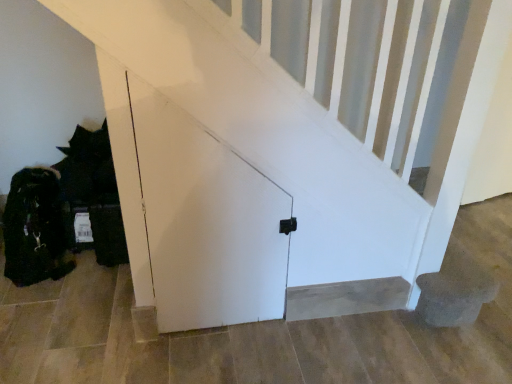
Question: Does smooth beige carpet at lower center appear on the left side of white matte door at center?

Choices:
 (A) no
 (B) yes

Answer: (A)

Question: Can you confirm if smooth beige carpet at lower center is shorter than white matte door at center?

Choices:
 (A) no
 (B) yes

Answer: (B)

Question: Does smooth beige carpet at lower center have a lesser width compared to white matte door at center?

Choices:
 (A) yes
 (B) no

Answer: (A)

Question: Can you confirm if smooth beige carpet at lower center is taller than white matte door at center?

Choices:
 (A) yes
 (B) no

Answer: (B)

Question: Considering the relative sizes of smooth beige carpet at lower center and white matte door at center in the image provided, is smooth beige carpet at lower center bigger than white matte door at center?

Choices:
 (A) no
 (B) yes

Answer: (A)

Question: Is smooth beige carpet at lower center not near white matte door at center?

Choices:
 (A) yes
 (B) no

Answer: (B)

Question: Can smooth beige carpet at lower center be found inside white matte door at center?

Choices:
 (A) no
 (B) yes

Answer: (A)

Question: Is white matte door at center at the right side of smooth beige carpet at lower center?

Choices:
 (A) yes
 (B) no

Answer: (B)

Question: Can you confirm if white matte door at center is wider than smooth beige carpet at lower center?

Choices:
 (A) no
 (B) yes

Answer: (B)

Question: Is white matte door at center positioned far away from smooth beige carpet at lower center?

Choices:
 (A) no
 (B) yes

Answer: (A)

Question: Is white matte door at center in front of smooth beige carpet at lower center?

Choices:
 (A) yes
 (B) no

Answer: (A)

Question: Is white matte door at center located outside smooth beige carpet at lower center?

Choices:
 (A) no
 (B) yes

Answer: (B)

Question: Based on their positions, is white matte door at center located to the left or right of smooth beige carpet at lower center?

Choices:
 (A) right
 (B) left

Answer: (B)